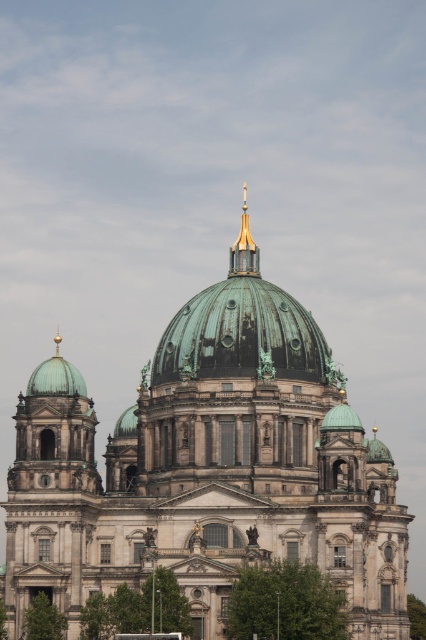
Question: Which point is closer to the camera taking this photo?

Choices:
 (A) (275, 429)
 (B) (233, 252)

Answer: (A)

Question: Observing the image, what is the correct spatial positioning of green copper dome at center in reference to gold polished metal spire at upper center?

Choices:
 (A) left
 (B) right

Answer: (A)

Question: Considering the relative positions of green copper dome at center and gold polished metal spire at upper center in the image provided, where is green copper dome at center located with respect to gold polished metal spire at upper center?

Choices:
 (A) above
 (B) below

Answer: (B)

Question: Can you confirm if green copper dome at center is positioned to the right of gold polished metal spire at upper center?

Choices:
 (A) no
 (B) yes

Answer: (A)